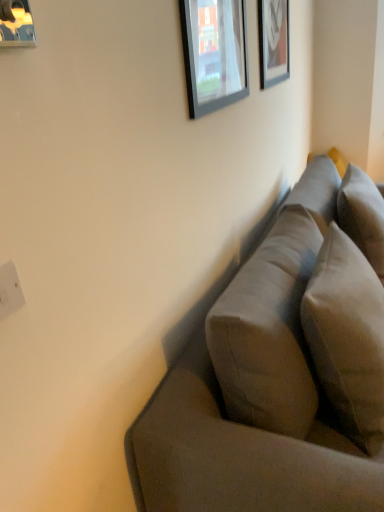
Question: Looking at the image, does wooden frame at upper right, positioned as the third picture frame in front-to-back order, seem bigger or smaller compared to white plastic electric outlet at lower left?

Choices:
 (A) big
 (B) small

Answer: (A)

Question: From a real-world perspective, is wooden frame at upper right, acting as the first picture frame starting from the back, positioned above or below white plastic electric outlet at lower left?

Choices:
 (A) below
 (B) above

Answer: (B)

Question: Which object is the farthest from the matte glass picture frame at upper center, the 2th picture frame from the front?

Choices:
 (A) white plastic electric outlet at lower left
 (B) metallic silver picture frame at upper left, which is counted as the third picture frame, starting from the right
 (C) suede-like gray couch at right
 (D) wooden frame at upper right, marked as the 3th picture frame in a left-to-right arrangement
 (E) suede-like beige pillow at right

Answer: (B)

Question: Which object is the closest to the suede-like beige pillow at right?

Choices:
 (A) white plastic electric outlet at lower left
 (B) metallic silver picture frame at upper left, which is counted as the third picture frame, starting from the right
 (C) wooden frame at upper right, positioned as the 1th picture frame in right-to-left order
 (D) matte glass picture frame at upper center, which ranks as the second picture frame in left-to-right order
 (E) suede-like gray couch at right

Answer: (E)